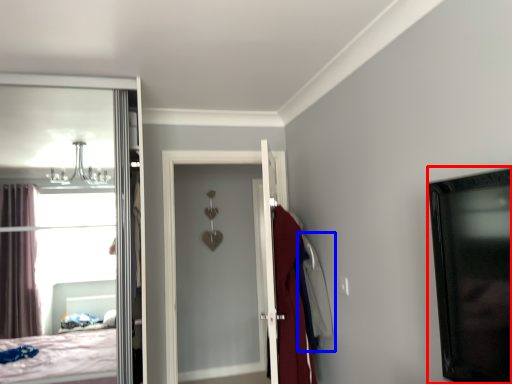
Question: Which point is further to the camera, picture frame (highlighted by a red box) or robe (highlighted by a blue box)?

Choices:
 (A) picture frame
 (B) robe

Answer: (B)